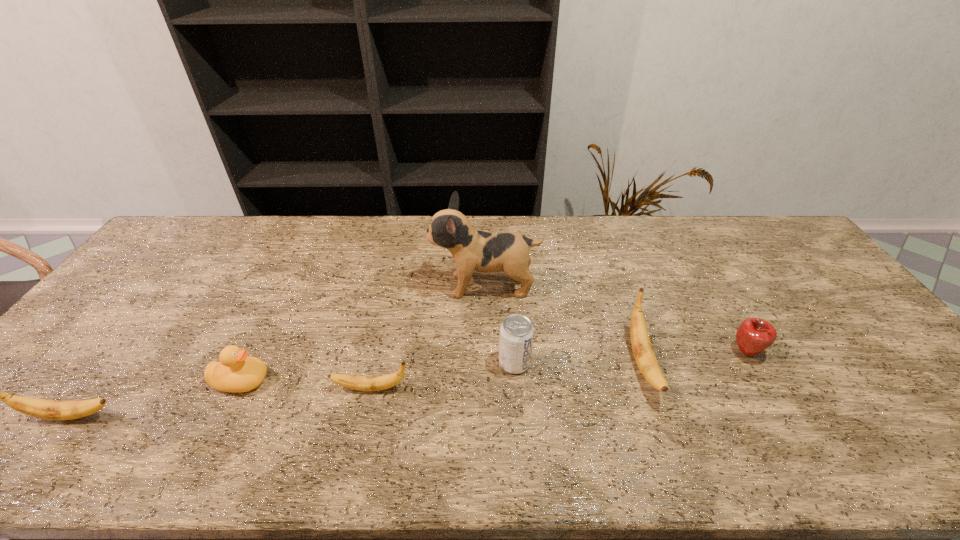
The height and width of the screenshot is (540, 960). I want to click on vacant area that lies between the soda can and the shortest banana, so click(x=443, y=375).

Locate an element on the screen. This screenshot has height=540, width=960. empty space between the second object from right to left and the soda can is located at coordinates (578, 363).

Find the location of a particular element. vacant region between the second shortest banana and the puppy is located at coordinates (277, 351).

I want to click on vacant point located between the second object from right to left and the sixth object from right to left, so click(x=442, y=372).

This screenshot has width=960, height=540. I want to click on empty space between the second object from left to right and the apple, so click(494, 366).

At what (x,y) coordinates should I click in order to perform the action: click on vacant space that's between the leftmost banana and the shortest banana. Please return your answer as a coordinate pair (x, y). Looking at the image, I should click on (220, 402).

Identify the location of object that stands as the third closest to the sixth object from right to left. This screenshot has height=540, width=960. (472, 250).

Select which object is the sixth closest to the farthest object. Please provide its 2D coordinates. Your answer should be formatted as a tuple, i.e. [(x, y)], where the tuple contains the x and y coordinates of a point satisfying the conditions above.

[(41, 408)]

The height and width of the screenshot is (540, 960). Identify the location of banana that is the second nearest to the apple. (362, 383).

The height and width of the screenshot is (540, 960). I want to click on banana that is the second closest to the second banana from left to right, so click(x=645, y=358).